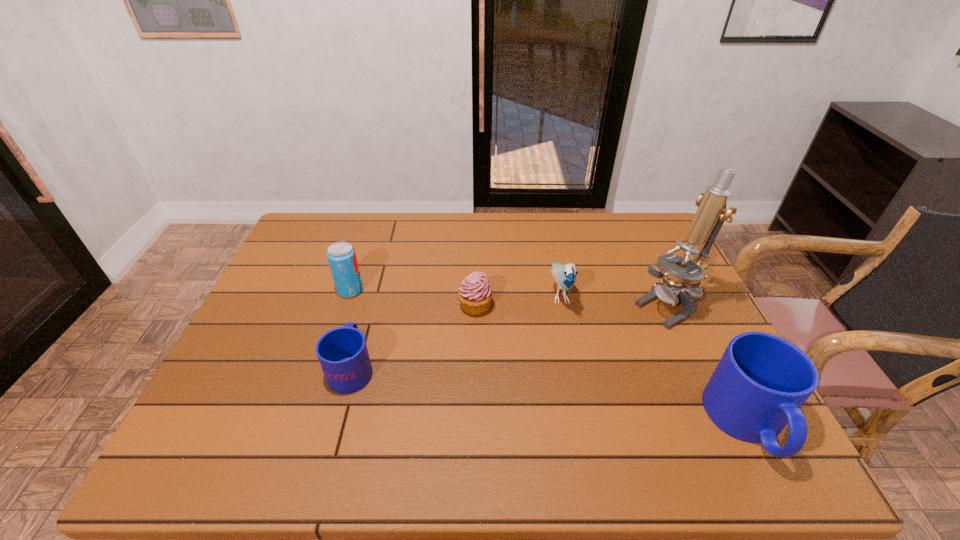
The height and width of the screenshot is (540, 960). What are the coordinates of `vacant space at the far left corner of the desktop` in the screenshot? It's located at (338, 212).

The height and width of the screenshot is (540, 960). In order to click on vacant area at the near left corner in this screenshot , I will do `click(228, 397)`.

The height and width of the screenshot is (540, 960). What are the coordinates of `vacant space in between the right mug and the soda can` in the screenshot? It's located at (549, 357).

This screenshot has height=540, width=960. Identify the location of vacant area that lies between the cupcake and the soda can. (413, 299).

Image resolution: width=960 pixels, height=540 pixels. In order to click on vacant area that lies between the shorter mug and the right mug in this screenshot , I will do `click(549, 395)`.

This screenshot has height=540, width=960. What are the coordinates of `free space between the tallest object and the left mug` in the screenshot? It's located at (511, 338).

At what (x,y) coordinates should I click in order to perform the action: click on free space between the shorter mug and the third object from right to left. Please return your answer as a coordinate pair (x, y). The width and height of the screenshot is (960, 540). Looking at the image, I should click on (456, 330).

The width and height of the screenshot is (960, 540). In order to click on free space between the bird and the shorter mug in this screenshot , I will do pos(456,330).

Find the location of `vacant area between the cupcake and the soda can`. vacant area between the cupcake and the soda can is located at coordinates (413, 299).

You are a GUI agent. You are given a task and a screenshot of the screen. Output one action in this format:
    pyautogui.click(x=<x>, y=<y>)
    Task: Click on the free point between the right mug and the bird
    This screenshot has height=540, width=960.
    Given the screenshot: What is the action you would take?
    pyautogui.click(x=654, y=357)